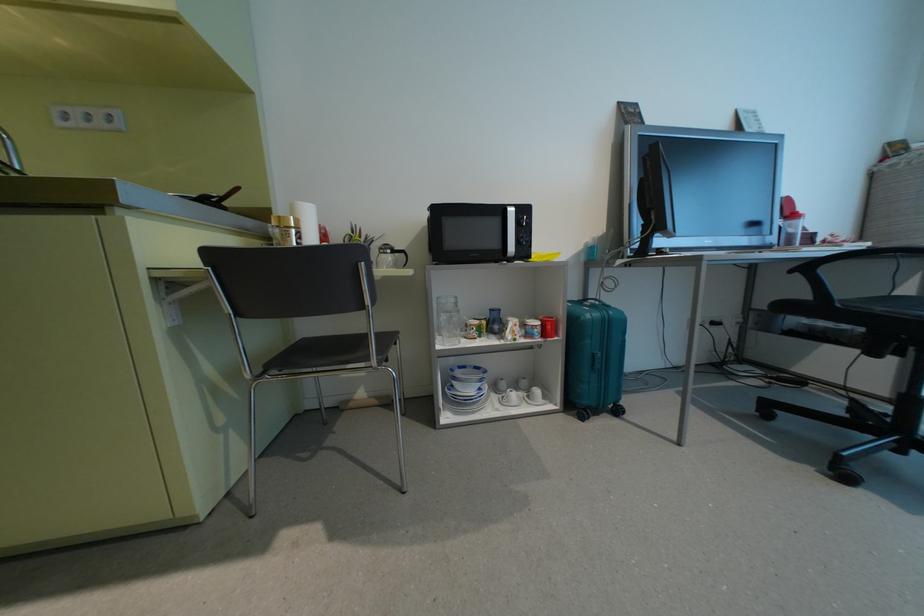
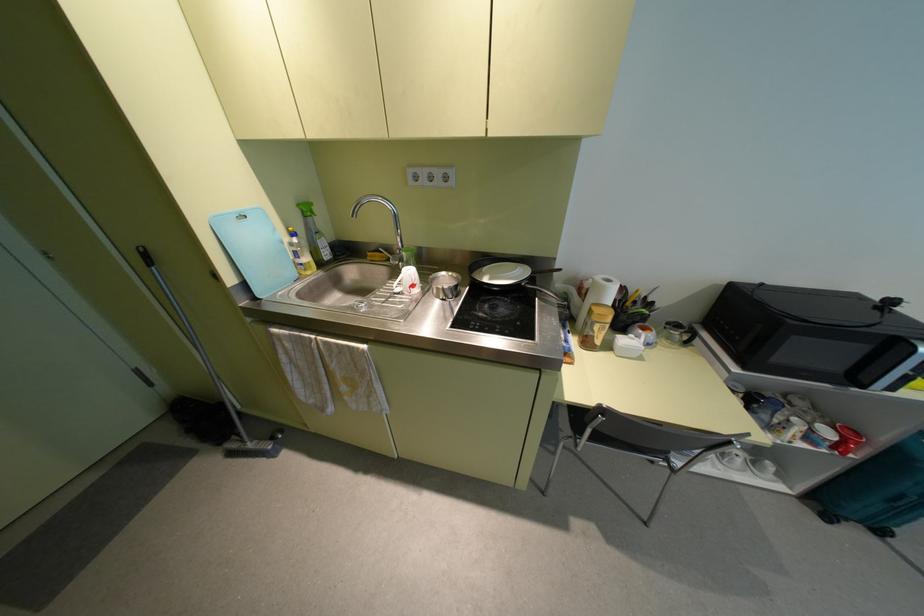
In the second image, find the point that corresponds to [616,411] in the first image.

(880, 531)